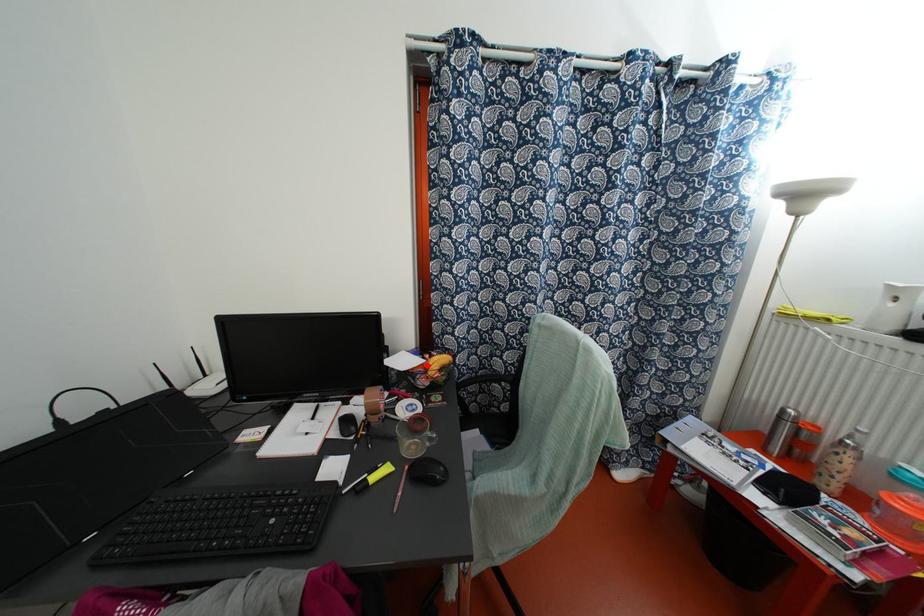
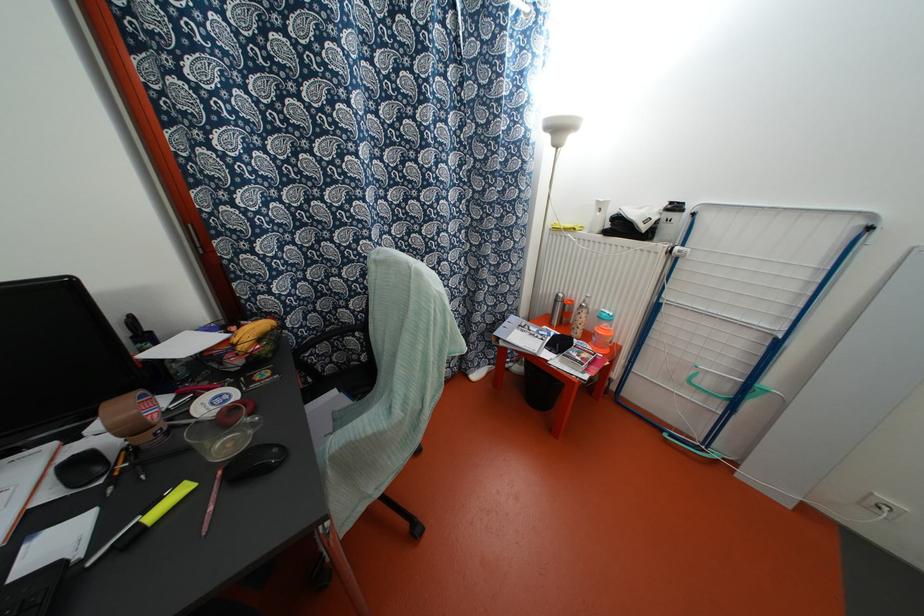
The point at the highlighted location is marked in the first image. Where is the corresponding point in the second image?

(234, 339)